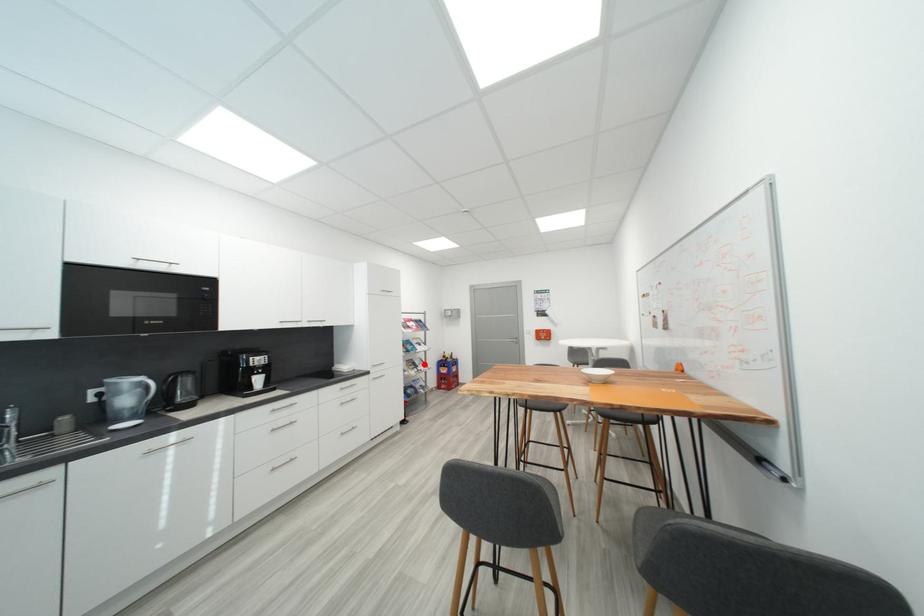
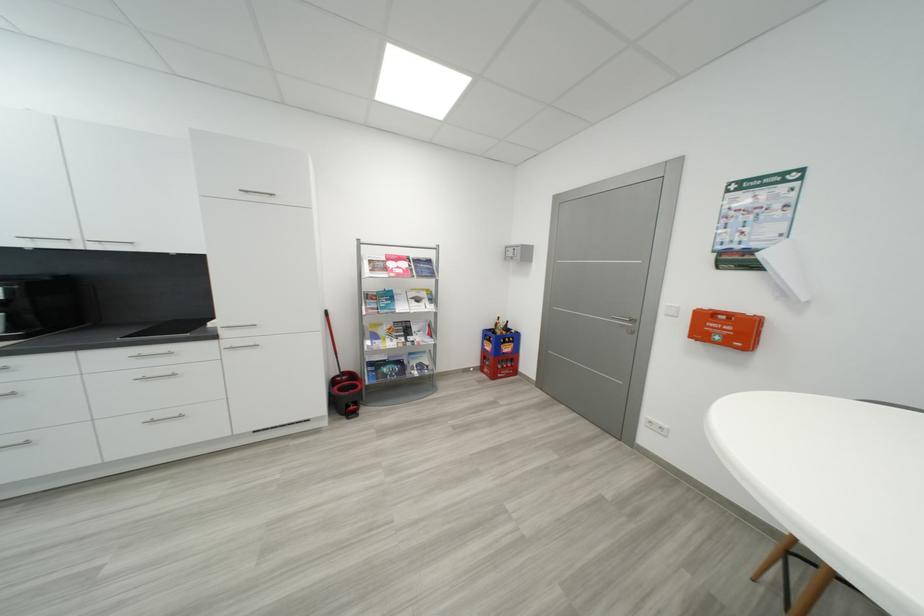
Question: I am providing you with two images of the same scene from different viewpoints. Image1 has a red point marked. In image2, the corresponding 3D location appears at what relative position? Reply with the corresponding letter.

Choices:
 (A) Closer
 (B) Farther

Answer: (A)